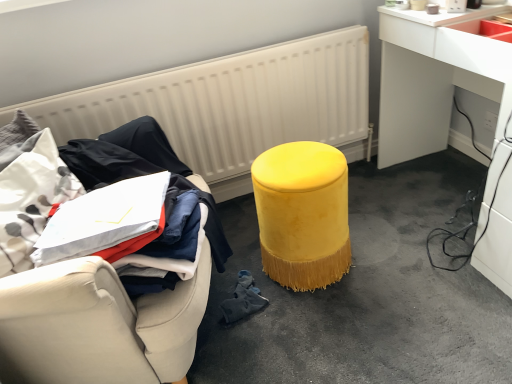
Where is `free region under white glossy desk at right (from a real-world perspective)`? free region under white glossy desk at right (from a real-world perspective) is located at coordinates (441, 187).